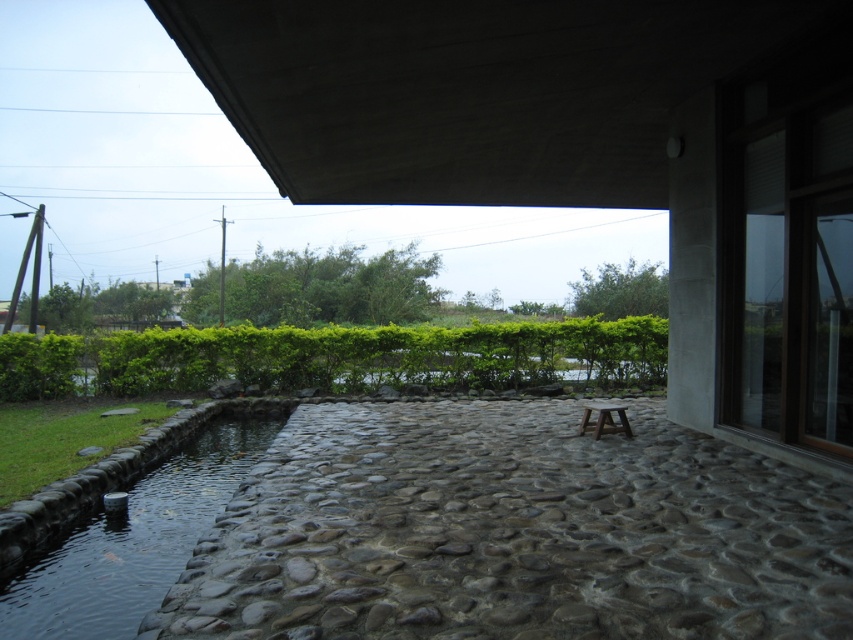
You are standing on the patio and want to take a photo of the green leafy hedge at center. Which direction should you face to capture it in your camera view?

The green leafy hedge at center is located at point coordinates, so you should face the center area of the patio to capture it in your camera view.

In the scene shown: You are planning to place a large garden statue that requires a spacious area. Based on the scene, which object between the green leafy hedge at center and the clear water at pond left would be more suitable for placing the statue?

The green leafy hedge at center has a larger size compared to the clear water at pond left, so the statue would be more suitable to place near the green leafy hedge at center as it offers more space.